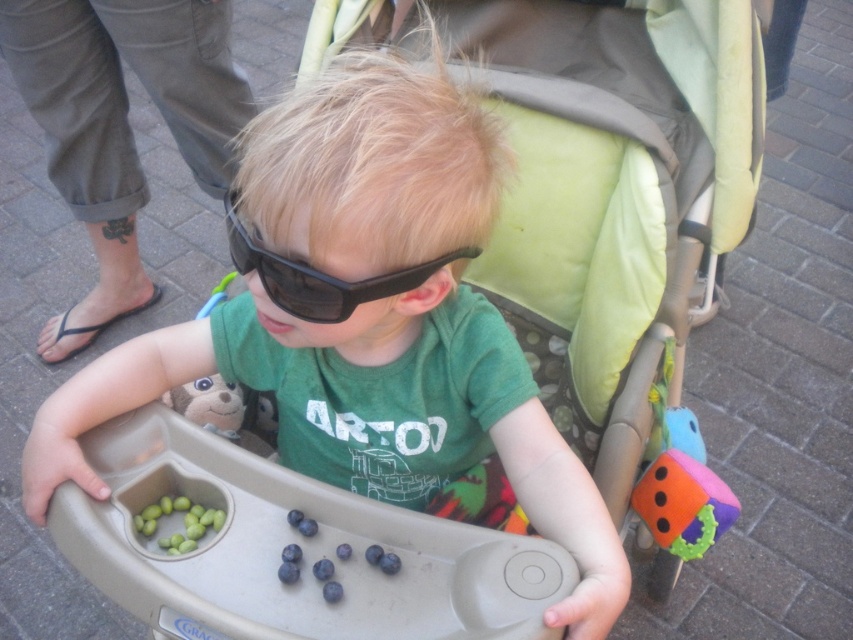
Question: Does matte black sunglasses at center have a greater width compared to green fabric baby carriage at center?

Choices:
 (A) no
 (B) yes

Answer: (A)

Question: Observing the image, what is the correct spatial positioning of matte black sunglasses at center in reference to black matte sunglasses at center?

Choices:
 (A) above
 (B) below

Answer: (B)

Question: Which of the following is the closest to the observer?

Choices:
 (A) (225, 365)
 (B) (544, 208)
 (C) (660, 497)

Answer: (A)

Question: Is the position of black matte sunglasses at center more distant than that of rubberized orange die at center?

Choices:
 (A) yes
 (B) no

Answer: (B)

Question: Which point is farther to the camera?

Choices:
 (A) green matte grapes at lower left
 (B) black matte sunglasses at center
 (C) rubberized orange die at center
 (D) green fabric baby carriage at center

Answer: (C)

Question: Based on their relative distances, which object is farther from the green matte grapes at lower left?

Choices:
 (A) black matte sunglasses at center
 (B) matte black sunglasses at center
 (C) rubberized orange die at center

Answer: (C)